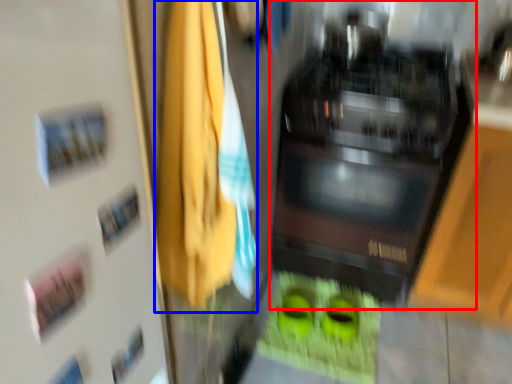
Question: Among these objects, which one is farthest to the camera, home appliance (highlighted by a red box) or laundry (highlighted by a blue box)?

Choices:
 (A) home appliance
 (B) laundry

Answer: (A)